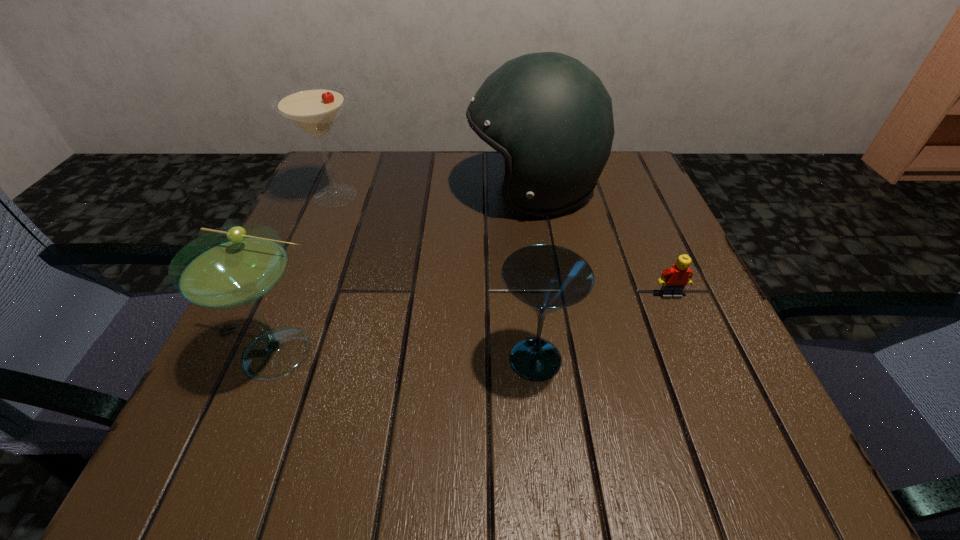
Identify the location of football helmet. This screenshot has height=540, width=960. (550, 116).

This screenshot has height=540, width=960. Find the location of `the farthest martini`. the farthest martini is located at coordinates (314, 109).

In order to click on the shortest martini in this screenshot , I will do `click(547, 278)`.

Identify the location of the rightmost martini. This screenshot has height=540, width=960. (547, 278).

Locate an element on the screen. The height and width of the screenshot is (540, 960). the third nearest object is located at coordinates (674, 279).

You are a GUI agent. You are given a task and a screenshot of the screen. Output one action in this format:
    pyautogui.click(x=<x>, y=<y>)
    Task: Click on the shortest object
    The image size is (960, 540).
    Given the screenshot: What is the action you would take?
    pyautogui.click(x=674, y=279)

Find the location of a particular element. free location located 0.190m at the face opening of the tallest object is located at coordinates (382, 191).

Locate an element on the screen. vacant space located 0.290m at the face opening of the tallest object is located at coordinates (338, 191).

Identify the location of free space located 0.050m at the face opening of the tallest object. The height and width of the screenshot is (540, 960). (445, 191).

Where is `vacant space located 0.100m on the front of the farthest martini`? vacant space located 0.100m on the front of the farthest martini is located at coordinates (315, 246).